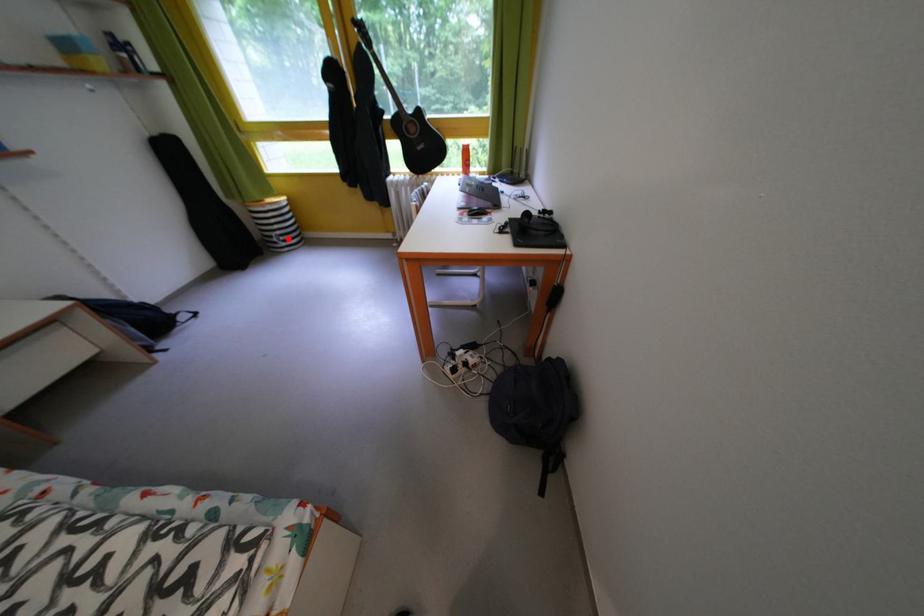
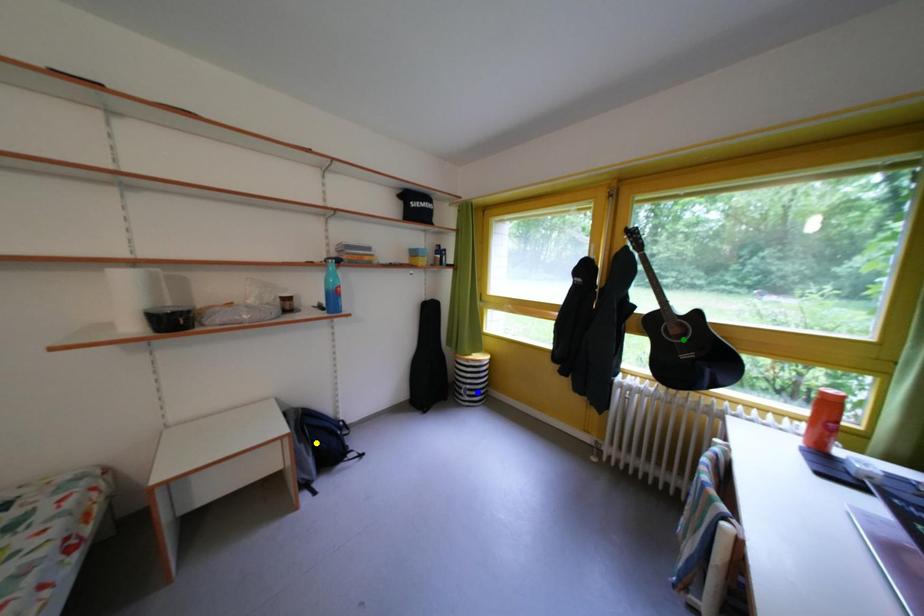
Question: I am providing you with two images of the same scene from different viewpoints. A red point is marked on the first image. You are given multiple points on the second image. Which point in image 2 is actually the same real-world point as the red point in image 1?

Choices:
 (A) yellow point
 (B) blue point
 (C) green point

Answer: (B)